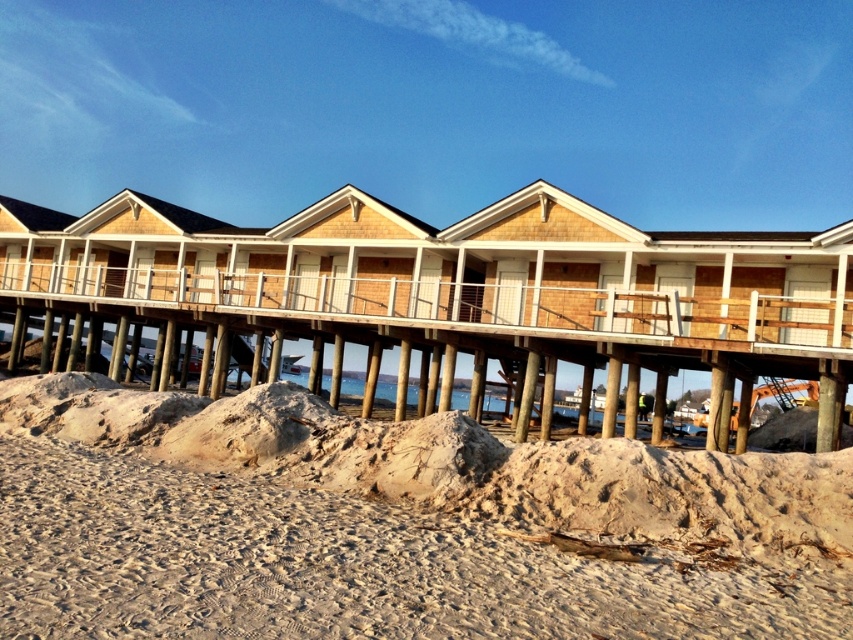
Is fine sand at lower center bigger than wooden dock at center?

Incorrect, fine sand at lower center is not larger than wooden dock at center.

Between point (148, 454) and point (99, 320), which one is positioned behind?

Point (99, 320)

Describe the element at coordinates (393, 525) in the screenshot. I see `fine sand at lower center` at that location.

Image resolution: width=853 pixels, height=640 pixels. Identify the location of fine sand at lower center. (393, 525).